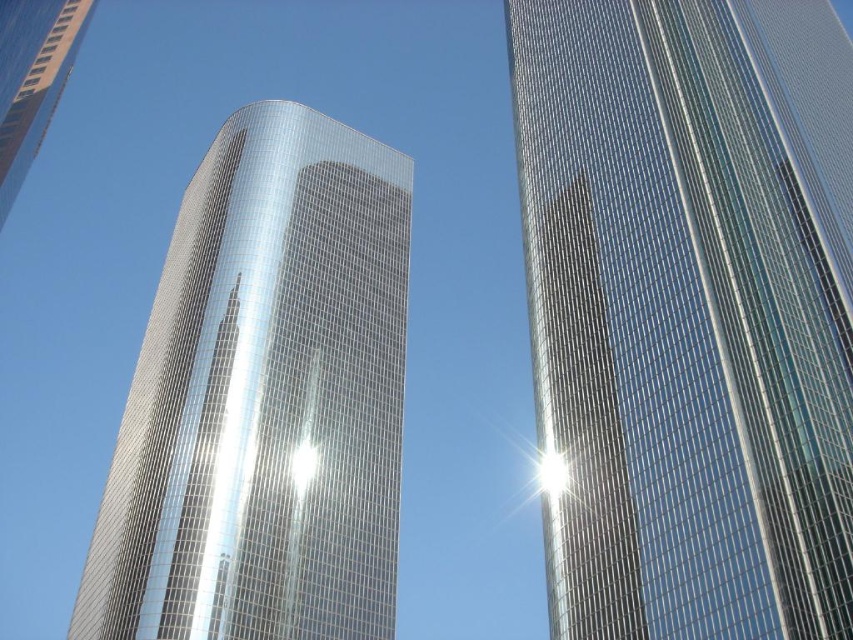
Consider the image. Does metallic glass tower at center have a larger size compared to polished glass skyscraper at upper left?

No.

Is point (544, 262) closer to camera compared to point (57, 99)?

Yes, point (544, 262) is in front of point (57, 99).

Where is `metallic glass tower at center`? The image size is (853, 640). metallic glass tower at center is located at coordinates (581, 432).

Identify the location of metallic glass tower at center. (581, 432).

Which is behind, point (598, 486) or point (360, 216)?

The point (360, 216) is behind.

Between glossy glass skyscraper at center and glossy metallic tower at center, which one is positioned lower?

glossy metallic tower at center

In order to click on glossy glass skyscraper at center in this screenshot , I will do `click(689, 310)`.

How much distance is there between glossy glass skyscraper at center and metallic glass tower at center?

They are 12.63 meters apart.

Does point (773, 337) come farther from viewer compared to point (572, 364)?

That is False.

Is point (764, 545) in front of point (547, 593)?

Yes, point (764, 545) is closer to viewer.

In order to click on glossy glass skyscraper at center in this screenshot , I will do `click(689, 310)`.